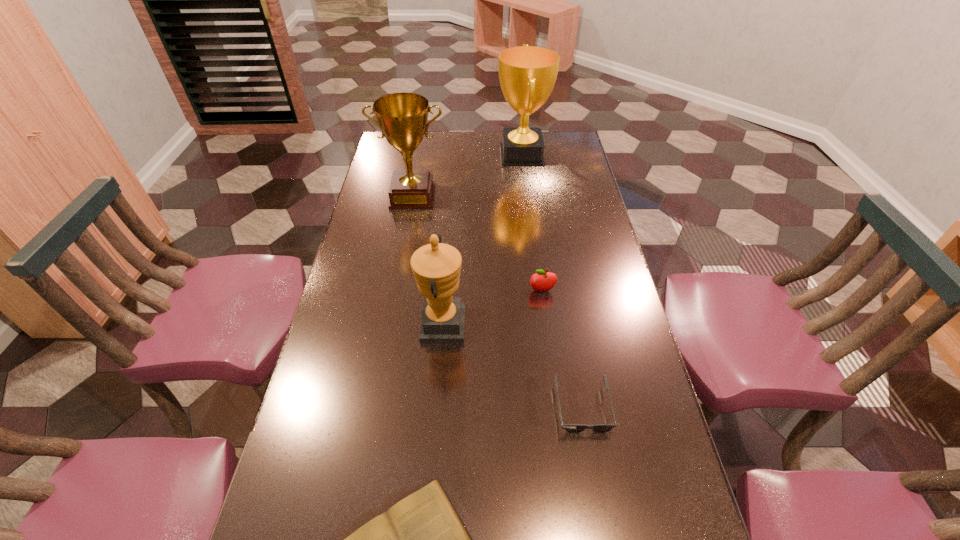
At what (x,y) coordinates should I click in order to perform the action: click on vacant space at the far edge. Please return your answer as a coordinate pair (x, y). Looking at the image, I should click on (433, 145).

Find the location of a particular element. Image resolution: width=960 pixels, height=540 pixels. blank space at the left edge of the desktop is located at coordinates (373, 234).

You are a GUI agent. You are given a task and a screenshot of the screen. Output one action in this format:
    pyautogui.click(x=<x>, y=<y>)
    Task: Click on the free space at the right edge
    
    Given the screenshot: What is the action you would take?
    pyautogui.click(x=569, y=199)

You are a GUI agent. You are given a task and a screenshot of the screen. Output one action in this format:
    pyautogui.click(x=<x>, y=<y>)
    Task: Click on the free space that is in between the farthest award and the apple
    The height and width of the screenshot is (540, 960).
    Given the screenshot: What is the action you would take?
    pyautogui.click(x=532, y=222)

You are a GUI agent. You are given a task and a screenshot of the screen. Output one action in this format:
    pyautogui.click(x=<x>, y=<y>)
    Task: Click on the empty location between the sunglasses and the fourth nearest object
    Image resolution: width=960 pixels, height=540 pixels.
    Given the screenshot: What is the action you would take?
    pyautogui.click(x=563, y=349)

You are a GUI agent. You are given a task and a screenshot of the screen. Output one action in this format:
    pyautogui.click(x=<x>, y=<y>)
    Task: Click on the vacant space that's between the farthest award and the fourth farthest object
    The width and height of the screenshot is (960, 540).
    Given the screenshot: What is the action you would take?
    pyautogui.click(x=482, y=240)

Where is `blank region between the third nearest object and the sunglasses`? blank region between the third nearest object and the sunglasses is located at coordinates (513, 367).

Locate an element on the screen. The image size is (960, 540). free space between the second shortest object and the third farthest object is located at coordinates (563, 349).

You are a GUI agent. You are given a task and a screenshot of the screen. Output one action in this format:
    pyautogui.click(x=<x>, y=<y>)
    Task: Click on the empty space that is in between the second nearest award and the second nearest object
    
    Given the screenshot: What is the action you would take?
    pyautogui.click(x=497, y=301)

Point out which object is positioned as the third nearest to the nearest award. Please provide its 2D coordinates. Your answer should be formatted as a tuple, i.e. [(x, y)], where the tuple contains the x and y coordinates of a point satisfying the conditions above.

[(421, 539)]